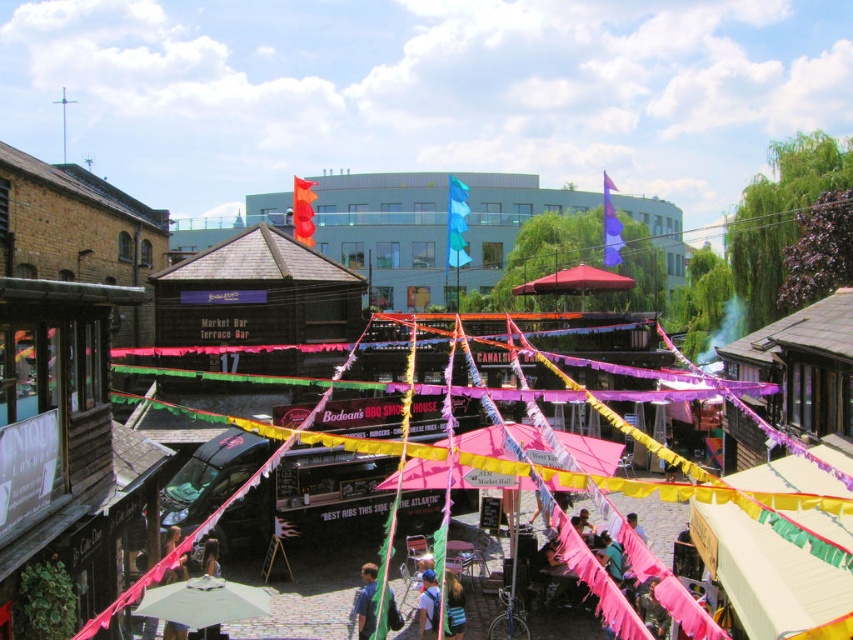
You are a delivery person who needs to park your shiny black van at center in a parking spot that can only accommodate vehicles up to the width of the blue fabric backpack at center. Can your van fit in the spot?

The shiny black van at center is wider than the blue fabric backpack at center, so it cannot fit into the parking spot designed for vehicles up to the backpacks width.